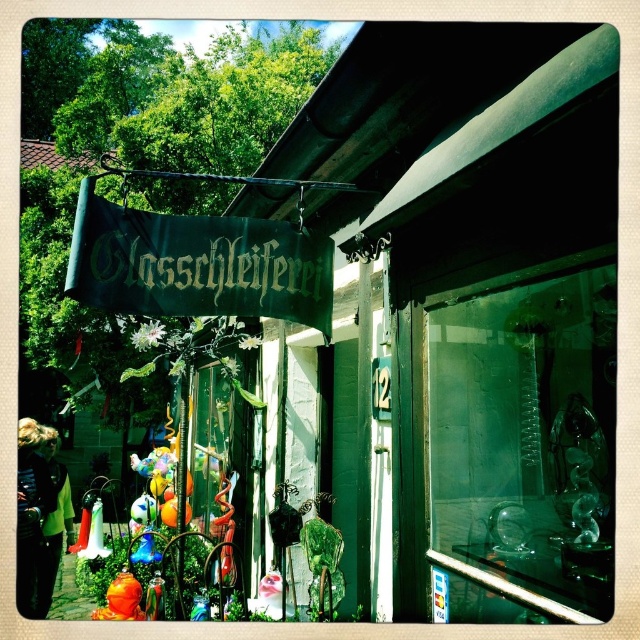
Question: Does transparent glass sculpture at center have a lesser width compared to green fabric sign at upper center?

Choices:
 (A) no
 (B) yes

Answer: (B)

Question: Is transparent glass sculpture at center below green fabric sign at upper center?

Choices:
 (A) no
 (B) yes

Answer: (B)

Question: Which of the following is the closest to the observer?

Choices:
 (A) (240, 234)
 (B) (563, 611)

Answer: (B)

Question: Is transparent glass sculpture at center positioned behind green fabric sign at upper center?

Choices:
 (A) no
 (B) yes

Answer: (A)

Question: Among these objects, which one is farthest from the camera?

Choices:
 (A) green fabric sign at upper center
 (B) transparent glass sculpture at center

Answer: (A)

Question: Which of the following is the farthest from the observer?

Choices:
 (A) (458, 493)
 (B) (292, 240)

Answer: (B)